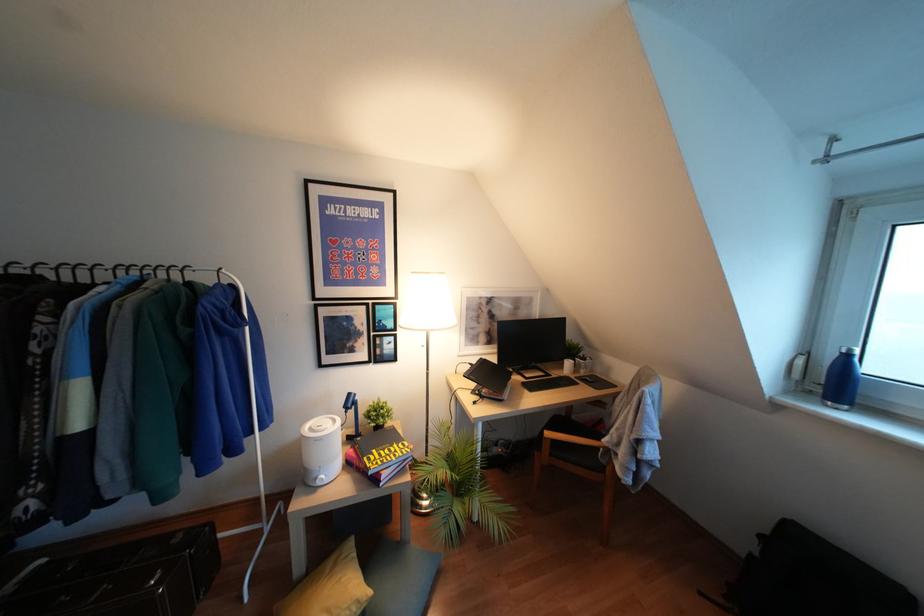
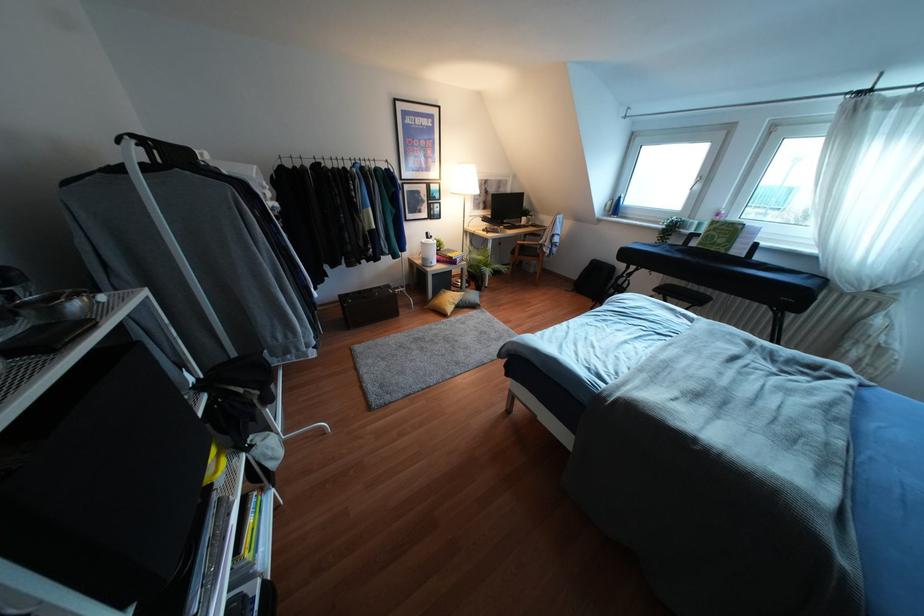
Where in the second image is the point corresponding to [348,394] from the first image?

(427, 233)